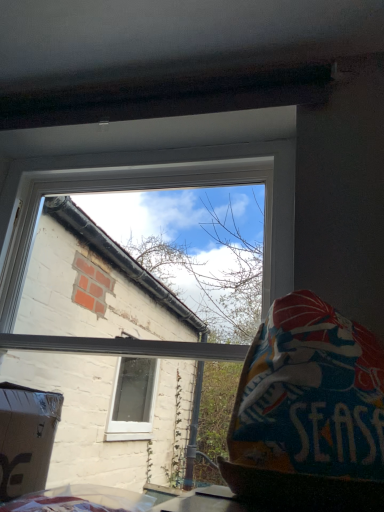
Question: Could you tell me if white plastic window at upper center is turned towards textured fabric bean bag at right?

Choices:
 (A) no
 (B) yes

Answer: (B)

Question: Can you confirm if white plastic window at upper center is positioned to the left of textured fabric bean bag at right?

Choices:
 (A) yes
 (B) no

Answer: (A)

Question: From the image's perspective, is white plastic window at upper center beneath textured fabric bean bag at right?

Choices:
 (A) yes
 (B) no

Answer: (B)

Question: Can you confirm if white plastic window at upper center is wider than textured fabric bean bag at right?

Choices:
 (A) yes
 (B) no

Answer: (B)

Question: Is the depth of white plastic window at upper center less than that of textured fabric bean bag at right?

Choices:
 (A) yes
 (B) no

Answer: (B)

Question: Is white plastic window at upper center thinner than textured fabric bean bag at right?

Choices:
 (A) no
 (B) yes

Answer: (B)

Question: Considering the relative sizes of textured fabric bean bag at right and white plastic window at upper center in the image provided, is textured fabric bean bag at right bigger than white plastic window at upper center?

Choices:
 (A) no
 (B) yes

Answer: (A)

Question: From the image's perspective, is textured fabric bean bag at right on top of white plastic window at upper center?

Choices:
 (A) no
 (B) yes

Answer: (A)

Question: Does textured fabric bean bag at right have a lesser height compared to white plastic window at upper center?

Choices:
 (A) no
 (B) yes

Answer: (B)

Question: Is textured fabric bean bag at right positioned far away from white plastic window at upper center?

Choices:
 (A) no
 (B) yes

Answer: (A)

Question: Is textured fabric bean bag at right thinner than white plastic window at upper center?

Choices:
 (A) no
 (B) yes

Answer: (A)

Question: Is textured fabric bean bag at right further to camera compared to white plastic window at upper center?

Choices:
 (A) yes
 (B) no

Answer: (B)

Question: Is point (382, 412) closer or farther from the camera than point (23, 225)?

Choices:
 (A) farther
 (B) closer

Answer: (B)